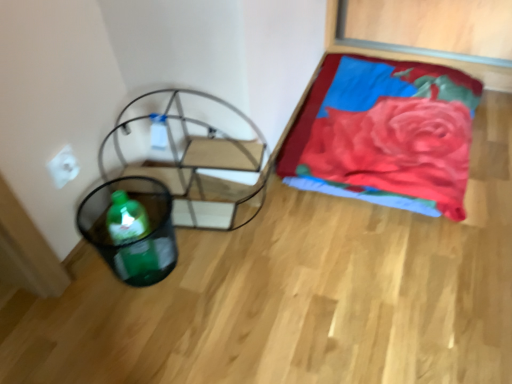
Question: Looking at the image, does metallic frame swivel chair at left seem bigger or smaller compared to velvet red blanket at upper right?

Choices:
 (A) big
 (B) small

Answer: (B)

Question: In the image, is metallic frame swivel chair at left positioned in front of or behind velvet red blanket at upper right?

Choices:
 (A) behind
 (B) front

Answer: (B)

Question: Considering the real-world distances, which object is farthest from the metallic frame swivel chair at left?

Choices:
 (A) green plastic basket at lower left
 (B) velvet red blanket at upper right
 (C) white matte electric outlet at upper left

Answer: (B)

Question: Which object is the farthest from the white matte electric outlet at upper left?

Choices:
 (A) velvet red blanket at upper right
 (B) green plastic basket at lower left
 (C) metallic frame swivel chair at left

Answer: (A)